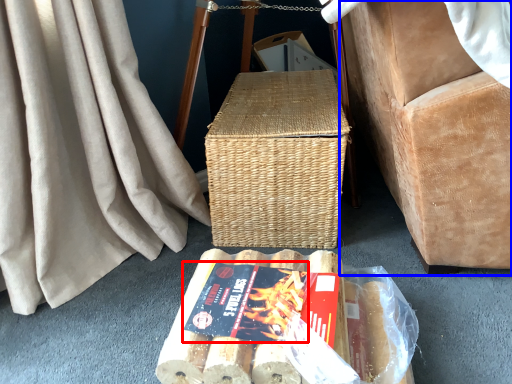
Question: Among these objects, which one is farthest to the camera, paperback book (highlighted by a red box) or furniture (highlighted by a blue box)?

Choices:
 (A) paperback book
 (B) furniture

Answer: (A)